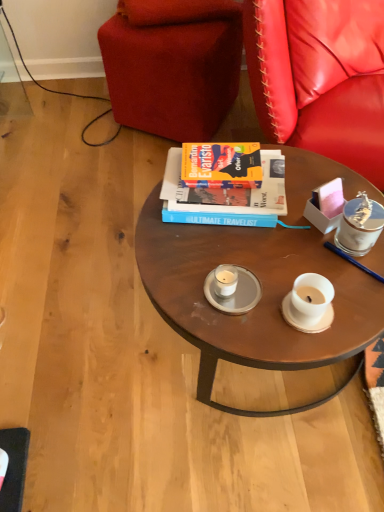
Where is `unoccupied region to the right of clear glass saucer at center`? The width and height of the screenshot is (384, 512). unoccupied region to the right of clear glass saucer at center is located at coordinates (313, 272).